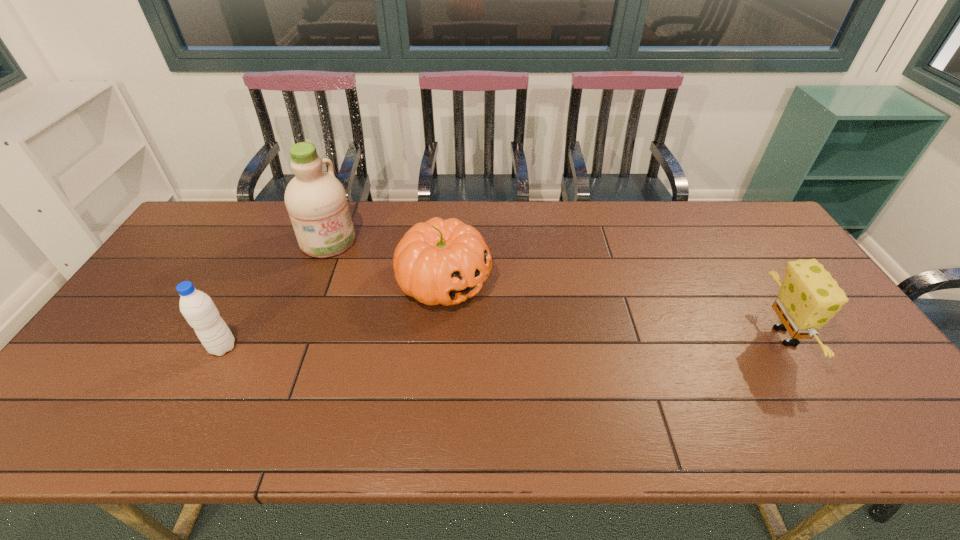
Locate an element on the screen. The image size is (960, 540). vacant spot on the desktop that is between the water bottle and the sponge and is positioned on the front label of the cleansing agent is located at coordinates (435, 343).

Image resolution: width=960 pixels, height=540 pixels. What are the coordinates of `vacant space on the desktop that is between the water bottle and the rightmost object and is positioned on the carved face of the third object from left to right` in the screenshot? It's located at (547, 341).